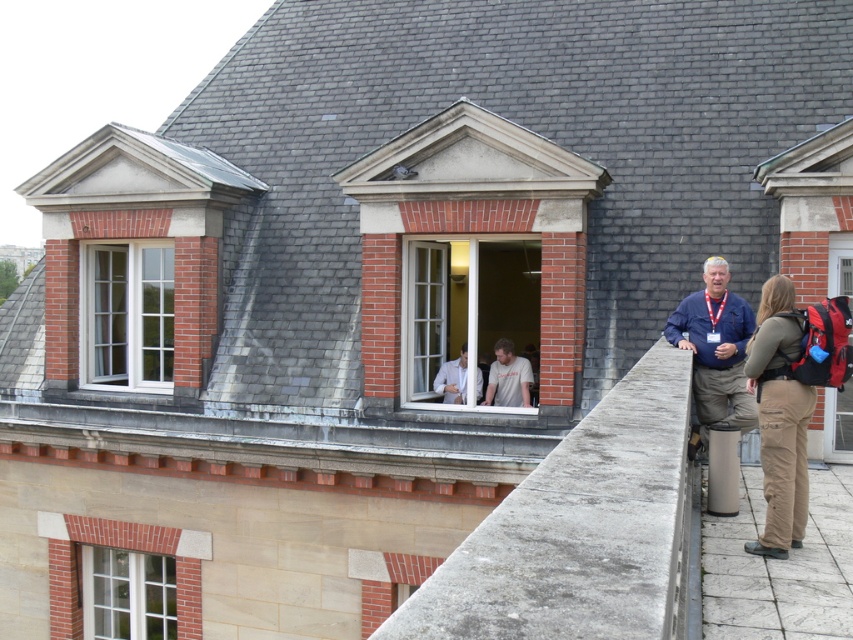
Question: Is khaki pants at right above white cotton t-shirt at center?

Choices:
 (A) no
 (B) yes

Answer: (B)

Question: Can you confirm if clear glass window at center is positioned below white cotton t-shirt at center?

Choices:
 (A) no
 (B) yes

Answer: (A)

Question: Considering the relative positions of concrete ledge at center and khaki pants at right in the image provided, where is concrete ledge at center located with respect to khaki pants at right?

Choices:
 (A) above
 (B) below

Answer: (A)

Question: Which object appears farthest from the camera in this image?

Choices:
 (A) khaki cotton pants at right
 (B) white glass window at lower left

Answer: (B)

Question: Which object is closer to the camera taking this photo?

Choices:
 (A) concrete ledge at center
 (B) khaki pants at right
 (C) white cotton t-shirt at center

Answer: (A)

Question: Which point is closer to the camera taking this photo?

Choices:
 (A) (775, 396)
 (B) (479, 372)
 (C) (140, 586)
 (D) (796, 426)

Answer: (A)